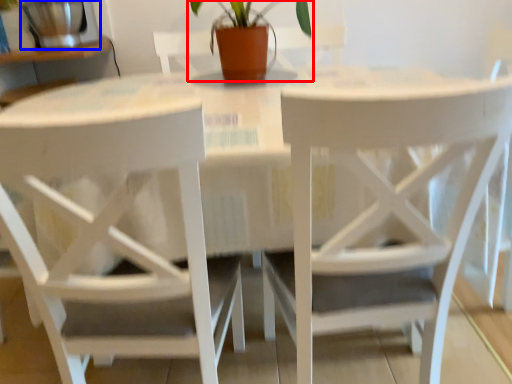
Question: Which object appears closest to the camera in this image, houseplant (highlighted by a red box) or appliance (highlighted by a blue box)?

Choices:
 (A) houseplant
 (B) appliance

Answer: (A)